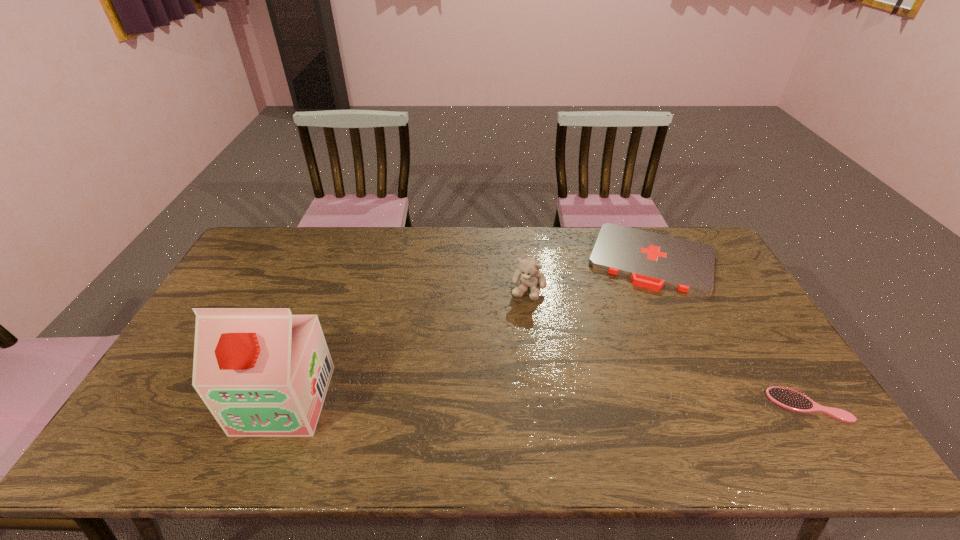
This screenshot has height=540, width=960. Find the location of `soya milk`. soya milk is located at coordinates (262, 372).

Locate an element on the screen. the tallest object is located at coordinates (262, 372).

Locate an element on the screen. hairbrush is located at coordinates (787, 398).

Locate an element on the screen. Image resolution: width=960 pixels, height=540 pixels. the third shortest object is located at coordinates (528, 273).

Find the location of a particular element. This screenshot has width=960, height=540. the second object from left to right is located at coordinates (528, 273).

In order to click on the first-aid kit in this screenshot , I will do `click(651, 260)`.

Identify the location of free location located 0.280m on the back of the hairbrush. The width and height of the screenshot is (960, 540). (748, 311).

Locate an element on the screen. Image resolution: width=960 pixels, height=540 pixels. free region located on the face of the second object from left to right is located at coordinates (492, 383).

I want to click on vacant region located on the face of the second object from left to right, so click(481, 408).

This screenshot has width=960, height=540. I want to click on free spot located on the face of the second object from left to right, so click(488, 392).